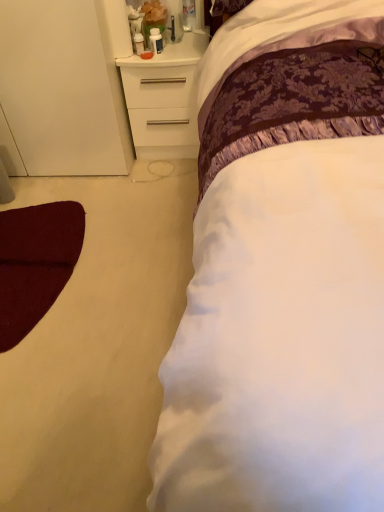
This screenshot has height=512, width=384. Describe the element at coordinates (164, 99) in the screenshot. I see `white matte chest of drawers at upper left` at that location.

Locate an element on the screen. white matte chest of drawers at upper left is located at coordinates click(164, 99).

Where is `white satin bed at center`? The width and height of the screenshot is (384, 512). white satin bed at center is located at coordinates (280, 339).

Measure the distance between point [274,443] and camera.

Point [274,443] and camera are 20.24 inches apart.

The height and width of the screenshot is (512, 384). What do you see at coordinates (280, 339) in the screenshot?
I see `white satin bed at center` at bounding box center [280, 339].

Find the location of `white matte chest of drawers at upper left`. white matte chest of drawers at upper left is located at coordinates (164, 99).

Between white matte chest of drawers at upper left and white satin bed at center, which one appears on the right side from the viewer's perspective?

Positioned to the right is white satin bed at center.

Which object is closer to the camera, white matte chest of drawers at upper left or white satin bed at center?

white satin bed at center.

Is point (132, 127) behind point (297, 339)?

That is True.

From the image's perspective, which one is positioned higher, white matte chest of drawers at upper left or white satin bed at center?

white matte chest of drawers at upper left appears higher in the image.

From a real-world perspective, relative to white satin bed at center, is white matte chest of drawers at upper left vertically above or below?

Clearly, from a real-world perspective, white matte chest of drawers at upper left is below white satin bed at center.

Between white matte chest of drawers at upper left and white satin bed at center, which one has larger width?

white satin bed at center.

Considering the sizes of objects white matte chest of drawers at upper left and white satin bed at center in the image provided, who is shorter, white matte chest of drawers at upper left or white satin bed at center?

white matte chest of drawers at upper left.

Is white matte chest of drawers at upper left bigger than white satin bed at center?

Incorrect, white matte chest of drawers at upper left is not larger than white satin bed at center.

Is white matte chest of drawers at upper left positioned beyond the bounds of white satin bed at center?

white matte chest of drawers at upper left lies outside white satin bed at center's area.

Is white matte chest of drawers at upper left positioned far away from white satin bed at center?

white matte chest of drawers at upper left is far away from white satin bed at center.

Is white matte chest of drawers at upper left turned away from white satin bed at center?

white matte chest of drawers at upper left is not turned away from white satin bed at center.

At what (x,y) coordinates should I click in order to perform the action: click on bed above the white matte chest of drawers at upper left (from a real-world perspective). Please return your answer as a coordinate pair (x, y). Looking at the image, I should click on (280, 339).

In the image, is white satin bed at center on the left side or the right side of white matte chest of drawers at upper left?

From the image, it's evident that white satin bed at center is to the right of white matte chest of drawers at upper left.

Is white satin bed at center further to camera compared to white matte chest of drawers at upper left?

No, white satin bed at center is closer to the viewer.

Does point (231, 315) come behind point (173, 155)?

No, it is not.

From the image's perspective, is white satin bed at center above or below white matte chest of drawers at upper left?

white satin bed at center is situated lower than white matte chest of drawers at upper left in the image.

From a real-world perspective, is white satin bed at center located beneath white matte chest of drawers at upper left?

Incorrect, from a real-world perspective, white satin bed at center is higher than white matte chest of drawers at upper left.

In the scene shown: Which object is thinner, white satin bed at center or white matte chest of drawers at upper left?

Thinner between the two is white matte chest of drawers at upper left.

Who is taller, white satin bed at center or white matte chest of drawers at upper left?

white satin bed at center.

Considering the relative sizes of white satin bed at center and white matte chest of drawers at upper left in the image provided, is white satin bed at center smaller than white matte chest of drawers at upper left?

No, white satin bed at center is not smaller than white matte chest of drawers at upper left.

Can we say white satin bed at center lies outside white matte chest of drawers at upper left?

Indeed, white satin bed at center is completely outside white matte chest of drawers at upper left.

Is white satin bed at center beside white matte chest of drawers at upper left?

They are not placed beside each other.

Is white satin bed at center facing away from white matte chest of drawers at upper left?

No.

How different are the orientations of white satin bed at center and white matte chest of drawers at upper left in degrees?

There is a 1.82-degree angle between the facing directions of white satin bed at center and white matte chest of drawers at upper left.

You are a GUI agent. You are given a task and a screenshot of the screen. Output one action in this format:
    pyautogui.click(x=<x>, y=<y>)
    Task: Click on the chest of drawers that is on the left side of white satin bed at center
    
    Given the screenshot: What is the action you would take?
    pyautogui.click(x=164, y=99)

At what (x,y) coordinates should I click in order to perform the action: click on chest of drawers behind the white satin bed at center. Please return your answer as a coordinate pair (x, y). Looking at the image, I should click on (164, 99).

You are a GUI agent. You are given a task and a screenshot of the screen. Output one action in this format:
    pyautogui.click(x=<x>, y=<y>)
    Task: Click on the chest of drawers above the white satin bed at center (from the image's perspective)
    Image resolution: width=384 pixels, height=512 pixels.
    Given the screenshot: What is the action you would take?
    pyautogui.click(x=164, y=99)